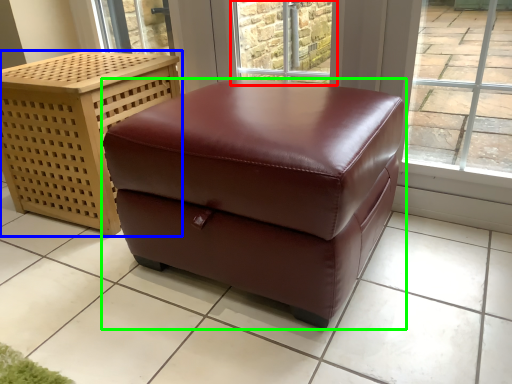
Question: Based on their relative distances, which object is farther from window (highlighted by a red box)? Choose from furniture (highlighted by a blue box) and table (highlighted by a green box).

Choices:
 (A) furniture
 (B) table

Answer: (B)